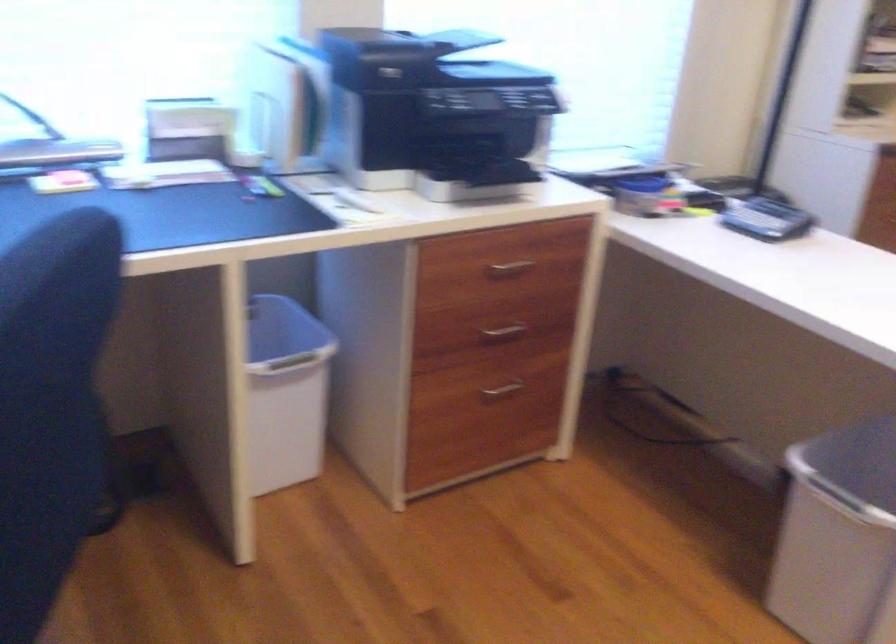
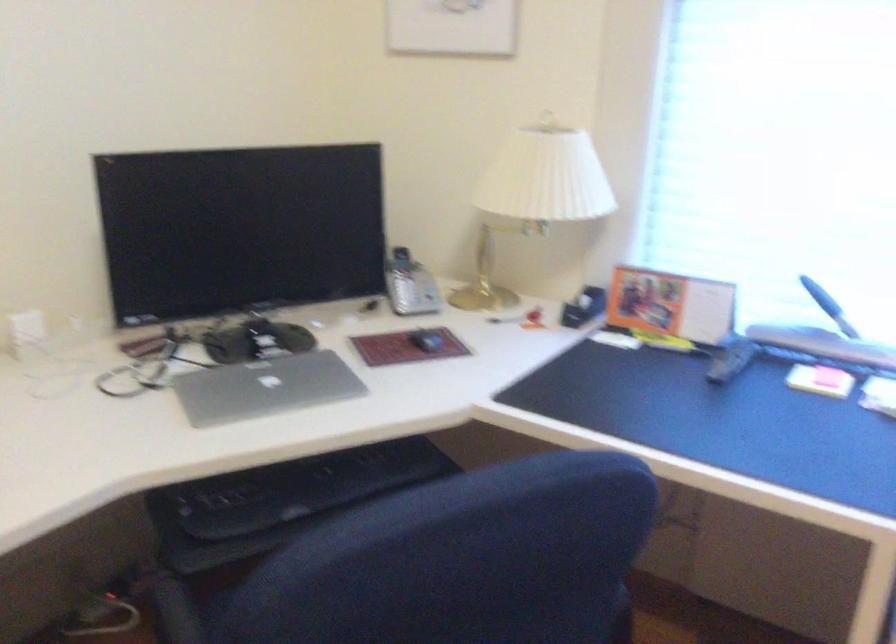
The point at (x=79, y=176) is marked in the first image. Where is the corresponding point in the second image?

(829, 377)